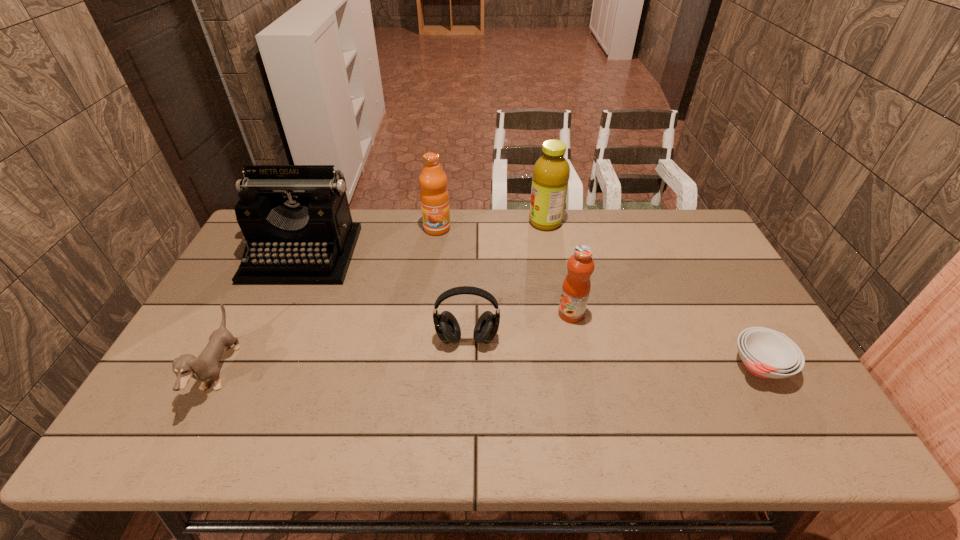
The width and height of the screenshot is (960, 540). Find the location of `vacant space situated 0.070m on the front label of the shortest fruit juice`. vacant space situated 0.070m on the front label of the shortest fruit juice is located at coordinates (534, 314).

Locate an element on the screen. This screenshot has height=540, width=960. free space located on the front label of the shortest fruit juice is located at coordinates (534, 314).

Locate an element on the screen. This screenshot has height=540, width=960. free space located on the front label of the shortest fruit juice is located at coordinates (432, 314).

At what (x,y) coordinates should I click in order to perform the action: click on free space located 0.200m on the ear cups of the third shortest object. Please return your answer as a coordinate pair (x, y). Looking at the image, I should click on (465, 421).

Locate an element on the screen. The image size is (960, 540). vacant area situated at the face of the second shortest object is located at coordinates (355, 373).

This screenshot has height=540, width=960. What are the coordinates of `vacant area situated 0.080m on the left of the rightmost object` in the screenshot? It's located at (700, 366).

Image resolution: width=960 pixels, height=540 pixels. Identify the location of typewriter present at the far edge. (296, 220).

This screenshot has height=540, width=960. Identify the location of object located at the near edge. (205, 367).

At what (x,y) coordinates should I click in order to perform the action: click on typewriter that is at the left edge. Please return your answer as a coordinate pair (x, y). This screenshot has height=540, width=960. Looking at the image, I should click on (296, 220).

Locate an element on the screen. Image resolution: width=960 pixels, height=540 pixels. puppy that is at the left edge is located at coordinates (205, 367).